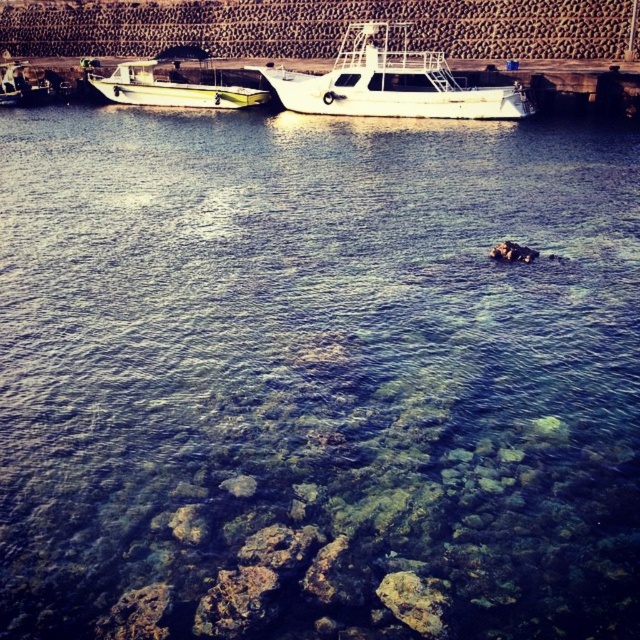
Question: Which of the following is the farthest from the observer?

Choices:
 (A) green matte boat at left
 (B) white glossy boat at center

Answer: (A)

Question: Which point is closer to the camera?

Choices:
 (A) metallic silver boat at left
 (B) white matte boat at upper left
 (C) green matte boat at left
 (D) white glossy boat at center

Answer: (D)

Question: Can you confirm if white glossy boat at center is bigger than metallic silver boat at left?

Choices:
 (A) no
 (B) yes

Answer: (B)

Question: Is green matte boat at left below metallic silver boat at left?

Choices:
 (A) yes
 (B) no

Answer: (A)

Question: Is green matte boat at left smaller than metallic silver boat at left?

Choices:
 (A) no
 (B) yes

Answer: (A)

Question: Which point is farther to the camera?

Choices:
 (A) white matte boat at upper left
 (B) metallic silver boat at left
 (C) green matte boat at left

Answer: (B)